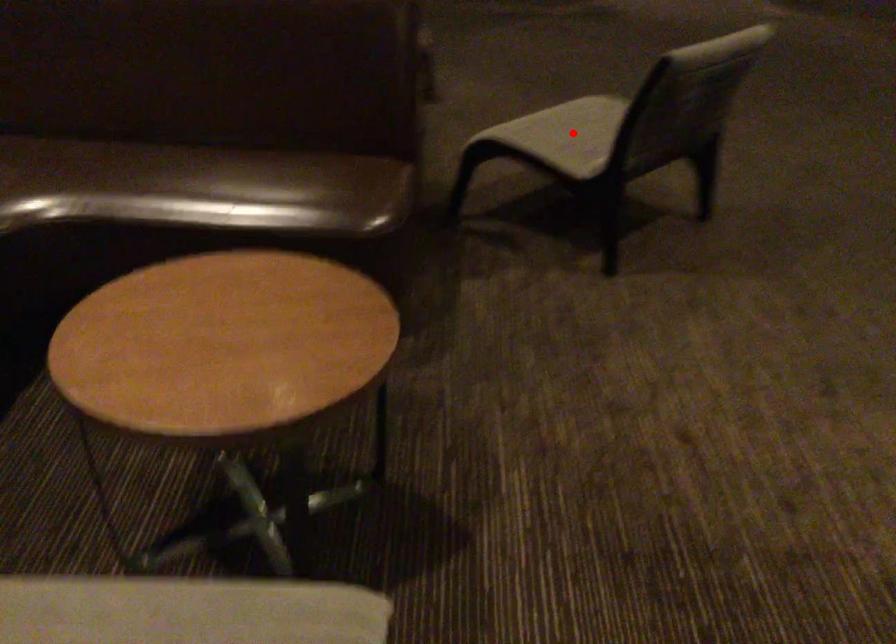
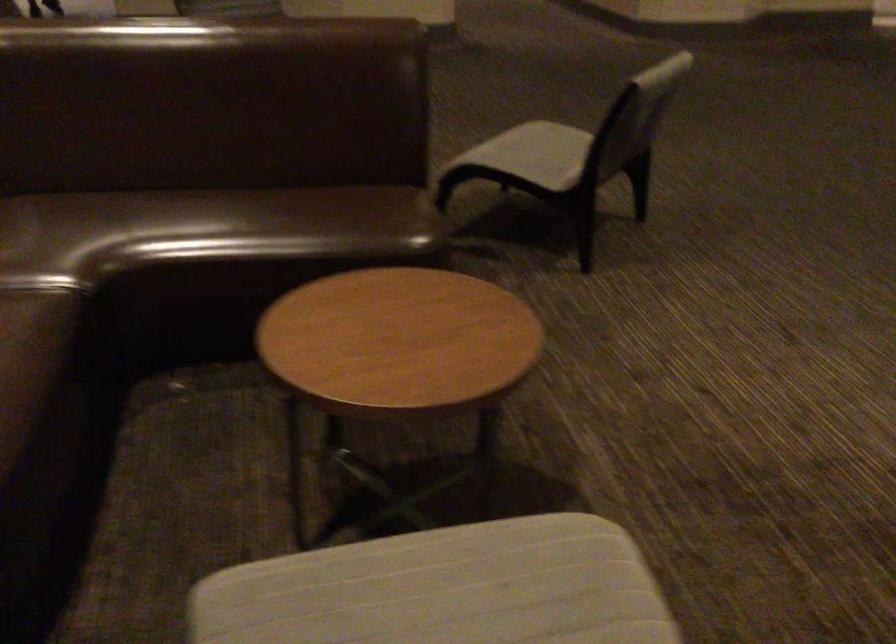
The point at the highlighted location is marked in the first image. Where is the corresponding point in the second image?

(533, 154)